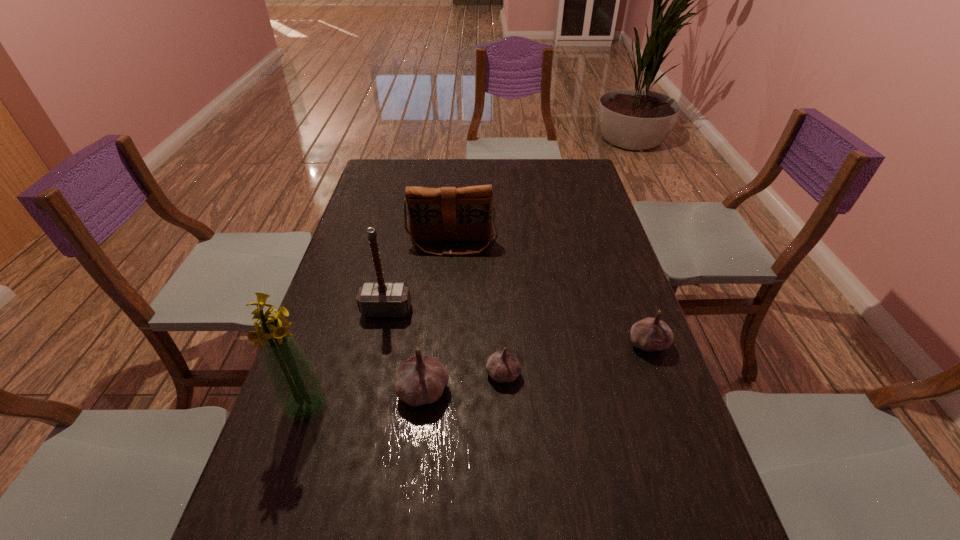
The height and width of the screenshot is (540, 960). Identify the location of object that is at the right edge. (650, 334).

The image size is (960, 540). In order to click on free space at the far edge of the desktop in this screenshot , I will do `click(523, 163)`.

In the image, there is a desktop. Where is `free space at the near edge`? free space at the near edge is located at coordinates (615, 521).

You are a GUI agent. You are given a task and a screenshot of the screen. Output one action in this format:
    pyautogui.click(x=<x>, y=<y>)
    Task: Click on the vacant space at the left edge of the desktop
    This screenshot has width=960, height=540.
    Given the screenshot: What is the action you would take?
    pyautogui.click(x=357, y=219)

In the image, there is a desktop. Where is `vacant space at the right edge`? vacant space at the right edge is located at coordinates (564, 233).

Locate an element on the screen. This screenshot has width=960, height=540. vacant area at the far left corner is located at coordinates (365, 188).

Image resolution: width=960 pixels, height=540 pixels. In the image, there is a desktop. Find the location of `free space at the near left corner`. free space at the near left corner is located at coordinates (296, 494).

Locate an element on the screen. The width and height of the screenshot is (960, 540). free space between the second farthest object and the fourth tallest object is located at coordinates (405, 350).

Identify the location of free space between the fourth nearest object and the shortest garlic. (576, 359).

Identify the location of empty space between the shoulder bag and the second farthest object. (420, 277).